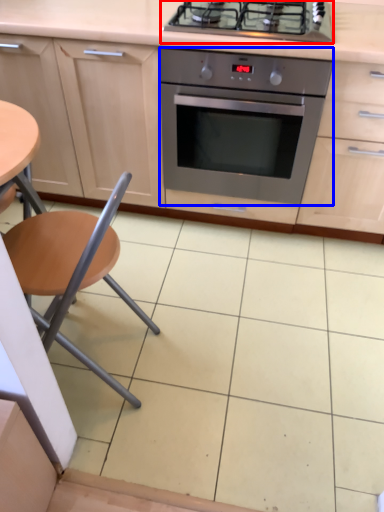
Question: Which point is closer to the camera, gas stove (highlighted by a red box) or kitchen appliance (highlighted by a blue box)?

Choices:
 (A) gas stove
 (B) kitchen appliance

Answer: (A)